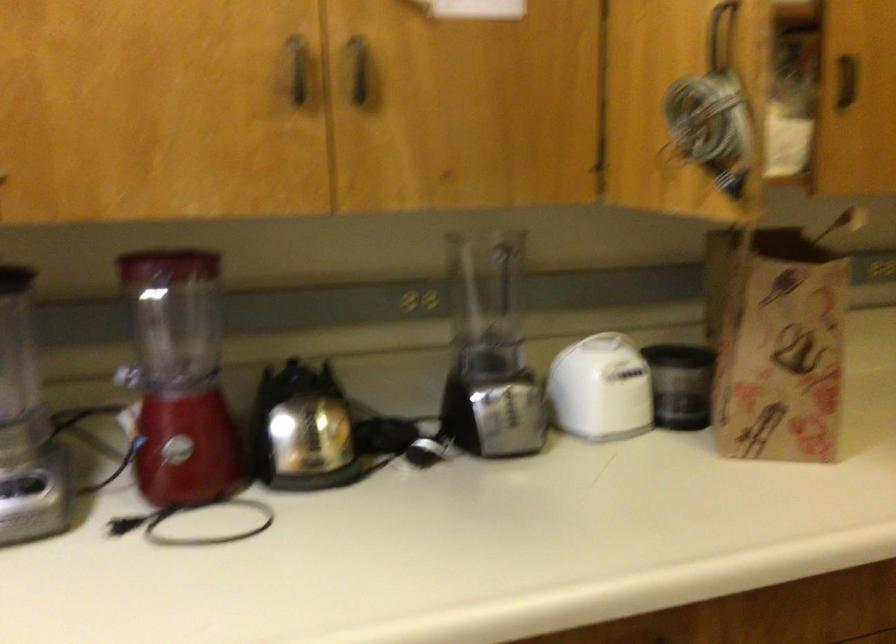
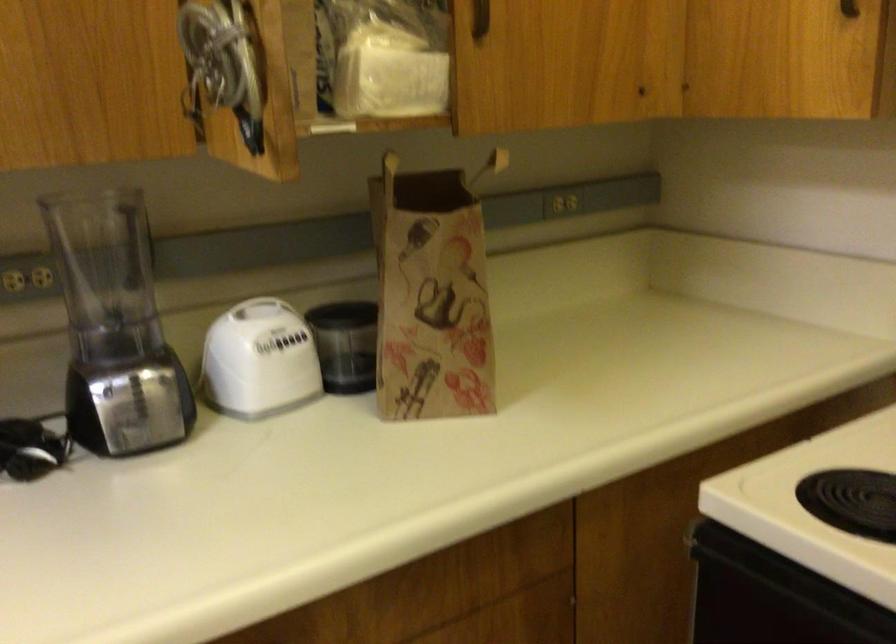
Find the pixel in the second image that matches the point at 518,404 in the first image.

(149, 395)